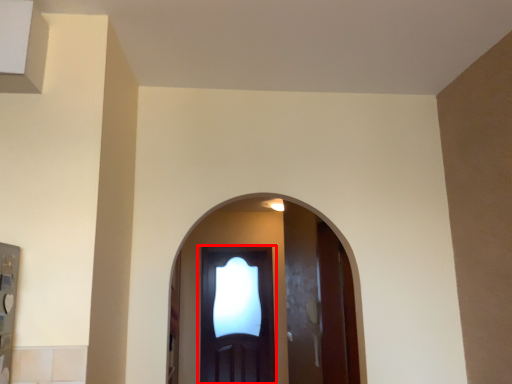
Question: In this image, where is door (annotated by the red box) located relative to screen door?

Choices:
 (A) right
 (B) left

Answer: (A)